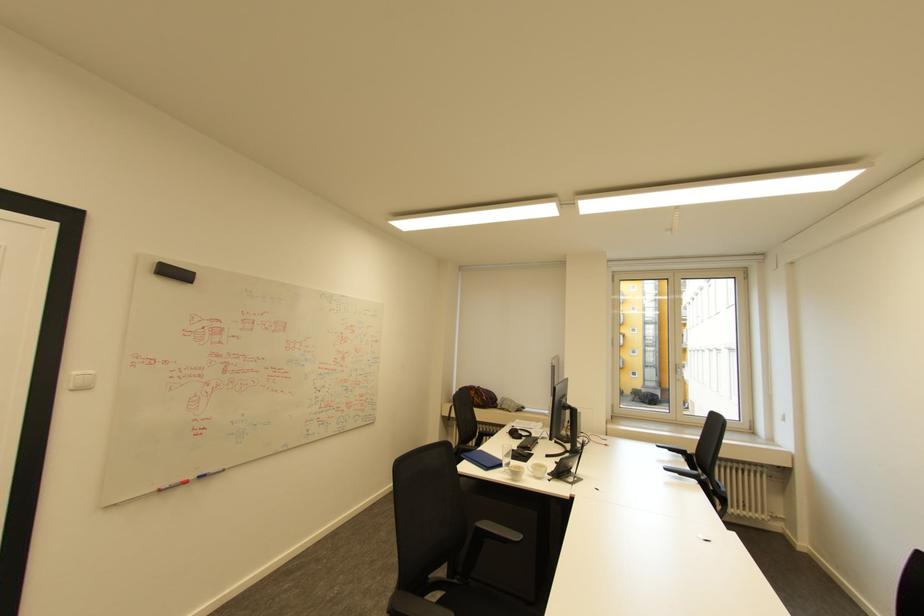
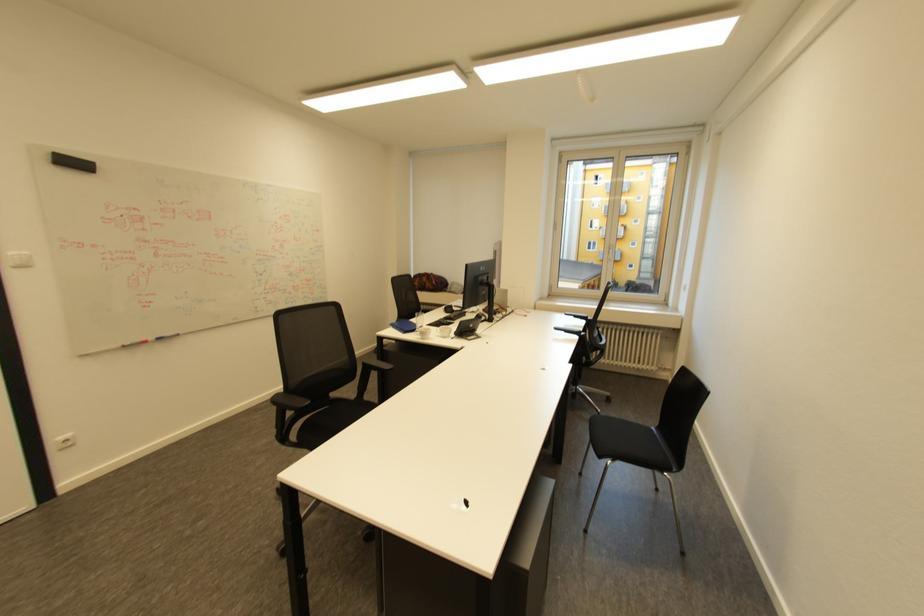
In a continuous first-person perspective shot, in which direction is the camera moving?

The movement direction of the cameraman is right, backward.